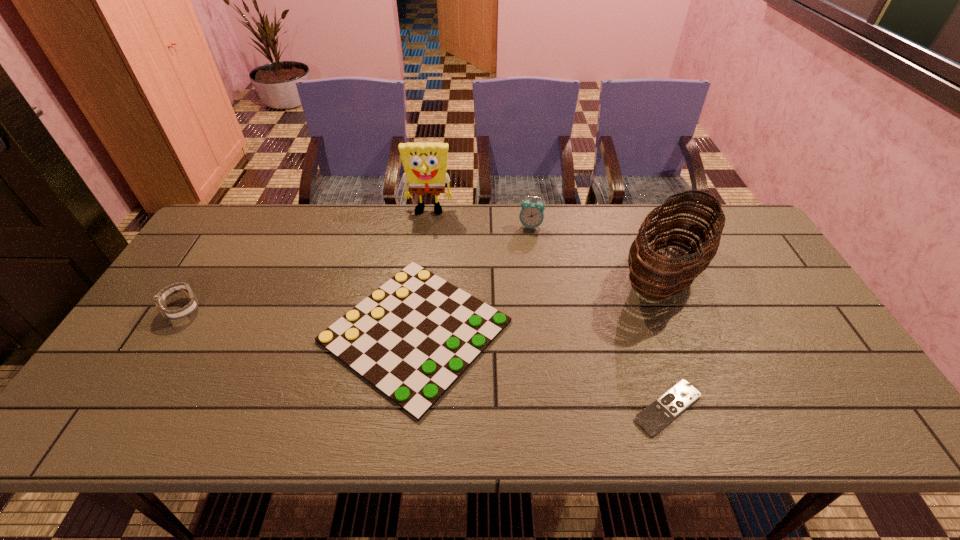
This screenshot has height=540, width=960. Identify the location of object situated at the left edge. (160, 299).

In the image, there is a desktop. Where is `vacant space at the far edge`? vacant space at the far edge is located at coordinates (448, 206).

Where is `free space at the near edge of the desktop`? The height and width of the screenshot is (540, 960). free space at the near edge of the desktop is located at coordinates (523, 410).

Where is `vacant space at the left edge of the desktop`? The height and width of the screenshot is (540, 960). vacant space at the left edge of the desktop is located at coordinates (141, 373).

This screenshot has height=540, width=960. In the image, there is a desktop. In order to click on vacant space at the right edge in this screenshot , I will do `click(823, 341)`.

This screenshot has width=960, height=540. Find the location of `vacant area between the fifth tallest object and the fifth shortest object`. vacant area between the fifth tallest object and the fifth shortest object is located at coordinates point(540,302).

Locate an element on the screen. The width and height of the screenshot is (960, 540). free space between the watch and the tallest object is located at coordinates (306, 260).

Locate an element on the screen. Image resolution: width=960 pixels, height=540 pixels. free space between the shortest object and the second tallest object is located at coordinates (666, 341).

Identify the location of vacant region between the watch and the alarm clock. This screenshot has width=960, height=540. (357, 267).

This screenshot has height=540, width=960. Find the location of `free point between the basket and the second shortest object`. free point between the basket and the second shortest object is located at coordinates (540, 302).